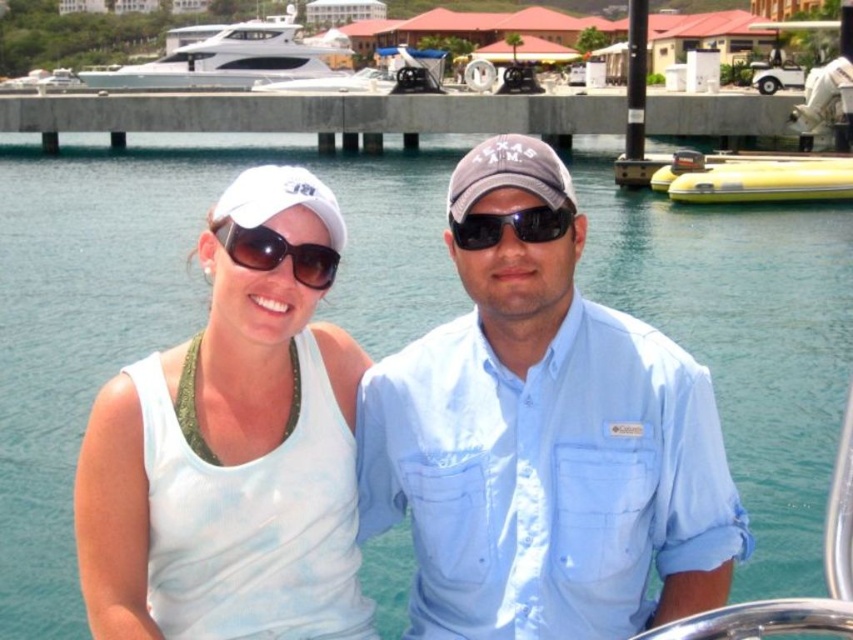
Who is lower down, white glossy yacht at upper left or sunglasses at center?

sunglasses at center is below.

Which is more to the right, white glossy yacht at upper left or sunglasses at center?

Positioned to the right is sunglasses at center.

Between point (113, 88) and point (267, 266), which one is positioned in front?

Point (267, 266)

Locate an element on the screen. The height and width of the screenshot is (640, 853). white glossy yacht at upper left is located at coordinates (227, 58).

Who is shorter, white glossy yacht at upper left or gray fabric baseball cap at center?

Standing shorter between the two is gray fabric baseball cap at center.

From the picture: Is white glossy yacht at upper left positioned in front of gray fabric baseball cap at center?

No, white glossy yacht at upper left is further to the viewer.

What do you see at coordinates (227, 58) in the screenshot?
I see `white glossy yacht at upper left` at bounding box center [227, 58].

Identify the location of white glossy yacht at upper left. (227, 58).

Which is behind, point (410, 620) or point (328, 244)?

Positioned behind is point (410, 620).

Locate an element on the screen. light blue cotton shirt at center is located at coordinates point(544,442).